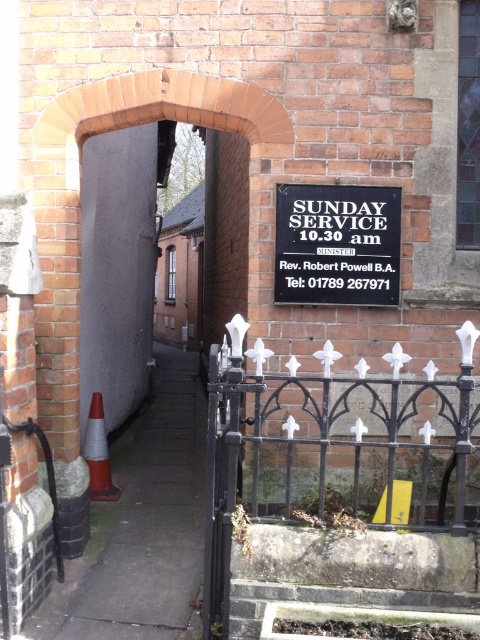
Question: Is gray concrete door at left smaller than black metal sign at center?

Choices:
 (A) yes
 (B) no

Answer: (B)

Question: Which object appears closest to the camera in this image?

Choices:
 (A) black wrought iron fence at right
 (B) gray concrete door at left
 (C) black metal sign at center

Answer: (A)

Question: Which point is closer to the camera?

Choices:
 (A) (249, 522)
 (B) (135, 202)

Answer: (A)

Question: Is gray concrete door at left below orange reflective cone at lower left?

Choices:
 (A) no
 (B) yes

Answer: (A)

Question: Can you confirm if black wrought iron fence at right is thinner than orange reflective cone at lower left?

Choices:
 (A) yes
 (B) no

Answer: (B)

Question: Among these points, which one is farthest from the camera?

Choices:
 (A) (86, 369)
 (B) (311, 436)

Answer: (A)